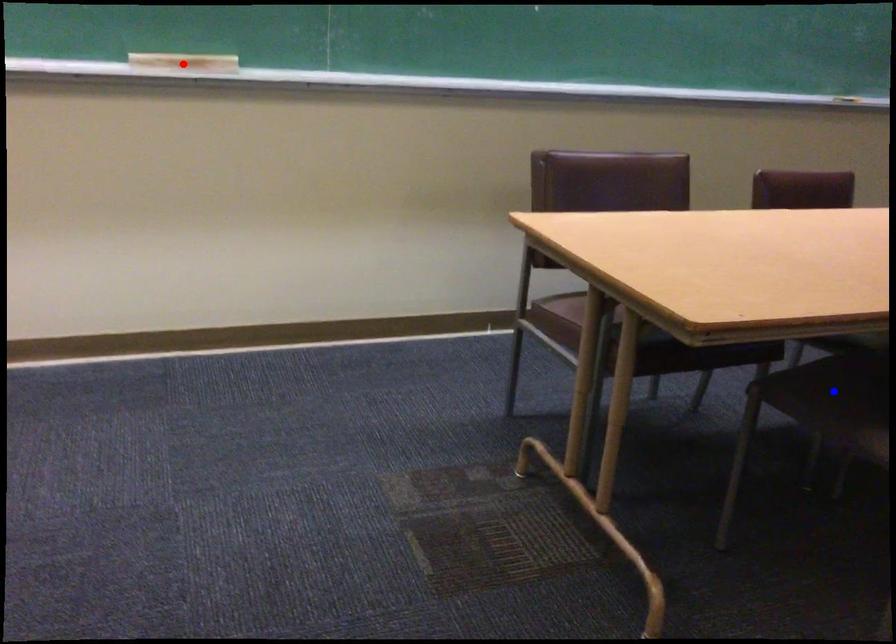
Question: Which of the two points in the image is closer to the camera?

Choices:
 (A) Blue point is closer.
 (B) Red point is closer.

Answer: (A)